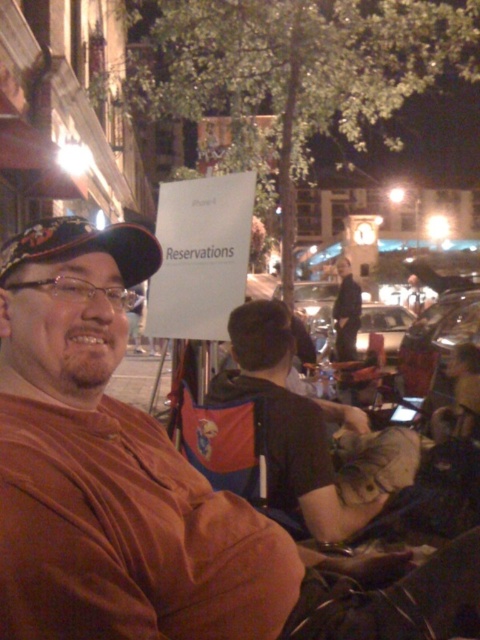
Question: Is brown cotton shirt at center further to the viewer compared to black fabric chair at center?

Choices:
 (A) no
 (B) yes

Answer: (A)

Question: Which of the following is the closest to the observer?

Choices:
 (A) (264, 308)
 (B) (83, 580)

Answer: (B)

Question: Does brown cotton shirt at center come in front of dark blue suit at center?

Choices:
 (A) no
 (B) yes

Answer: (B)

Question: Which object appears closest to the camera in this image?

Choices:
 (A) dark blue suit at center
 (B) brown cotton shirt at center
 (C) black fabric chair at center

Answer: (B)

Question: Does black fabric chair at center appear on the right side of dark blue suit at center?

Choices:
 (A) yes
 (B) no

Answer: (B)

Question: Which of the following is the farthest from the observer?

Choices:
 (A) (2, 520)
 (B) (402, 429)

Answer: (B)